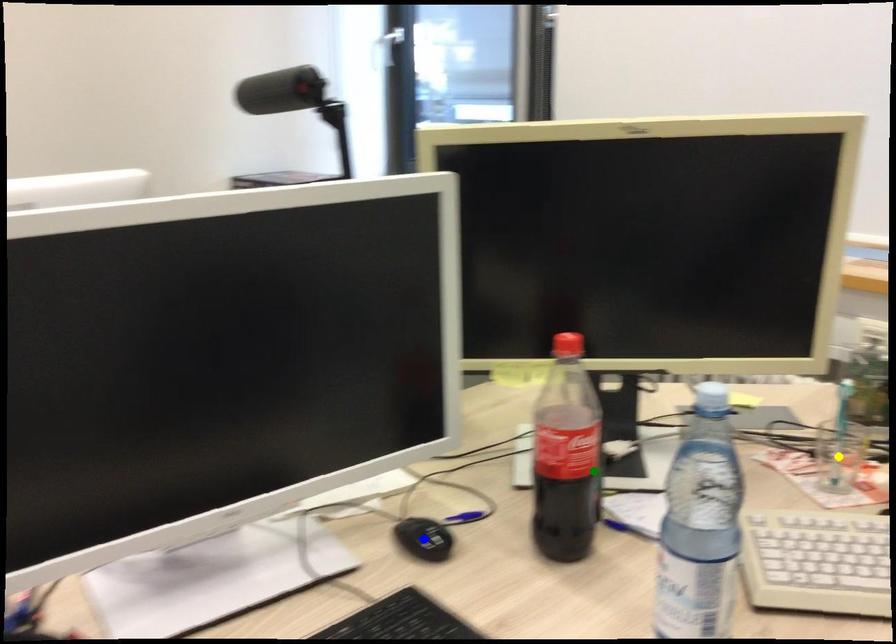
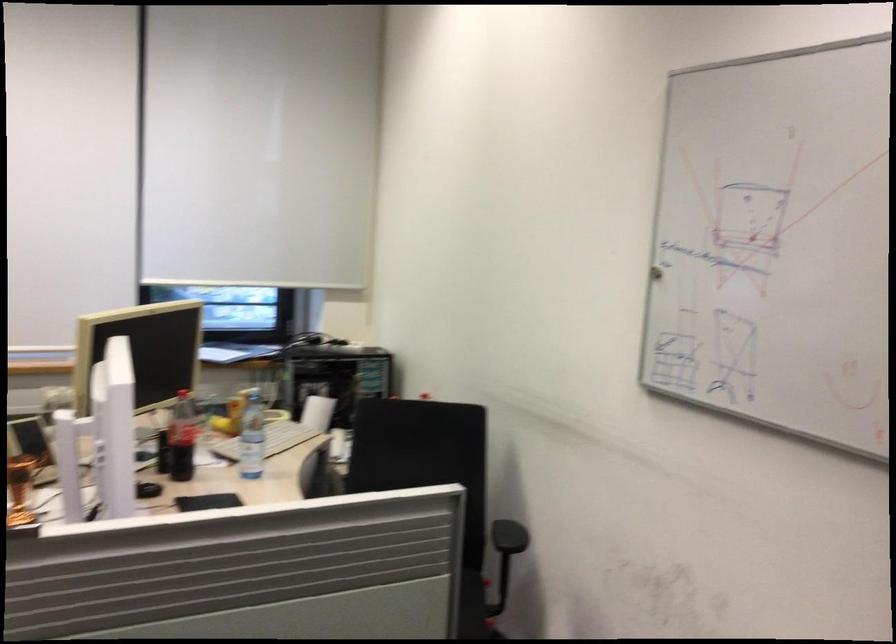
I am providing you with two images of the same scene from different viewpoints. Three points are marked in image1. Which point corresponds to a part or object that is occluded in image2?In image1, three points are marked. Which of them correspond to a part or object that is occluded in image2?Among the three points shown in image1, which one corresponds to a part or object that is no longer visible due to occlusion in image2?

Invisible in image2: blue point, yellow point.